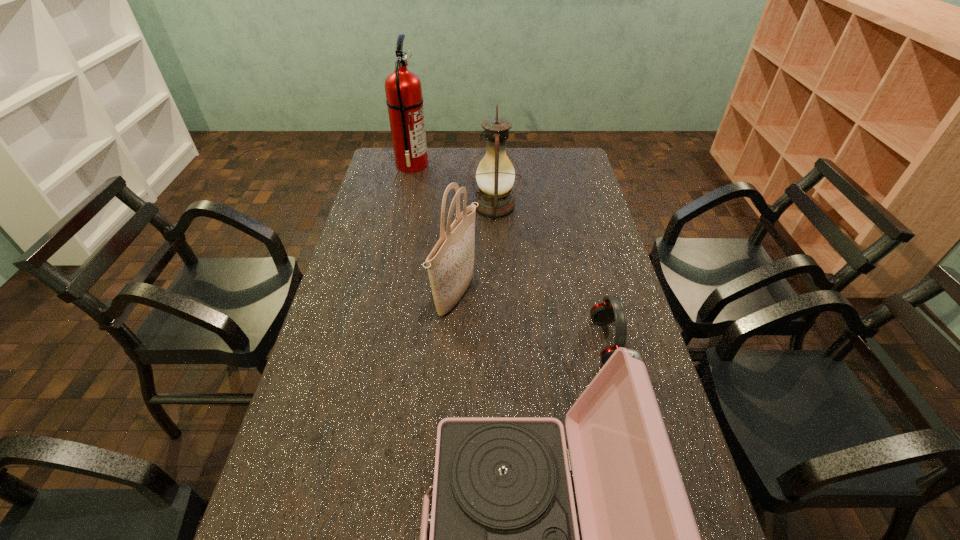
Where is `the farthest object`? the farthest object is located at coordinates (404, 100).

At what (x,y) coordinates should I click in order to perform the action: click on the leftmost object. Please return your answer as a coordinate pair (x, y). This screenshot has width=960, height=540. Looking at the image, I should click on (404, 100).

Where is `the fourth nearest object`? the fourth nearest object is located at coordinates (495, 175).

Find the location of a particular element. shopping bag is located at coordinates (450, 265).

Where is `the shortest object`? The width and height of the screenshot is (960, 540). the shortest object is located at coordinates (604, 313).

You are a GUI agent. You are given a task and a screenshot of the screen. Output one action in this format:
    pyautogui.click(x=<x>, y=<y>)
    Task: Click on the rightmost object
    
    Given the screenshot: What is the action you would take?
    pyautogui.click(x=604, y=313)

Identify the location of vacant space located 0.400m at the nozzle of the tallest object. Image resolution: width=960 pixels, height=540 pixels. (519, 165).

Identify the location of free region located on the front of the second farthest object. The height and width of the screenshot is (540, 960). (497, 283).

Where is `free point located 0.280m on the front of the shopping bag`? This screenshot has width=960, height=540. free point located 0.280m on the front of the shopping bag is located at coordinates (449, 421).

Where is `vacant space located 0.110m on the ear cups of the shortest object`? This screenshot has height=540, width=960. vacant space located 0.110m on the ear cups of the shortest object is located at coordinates (554, 343).